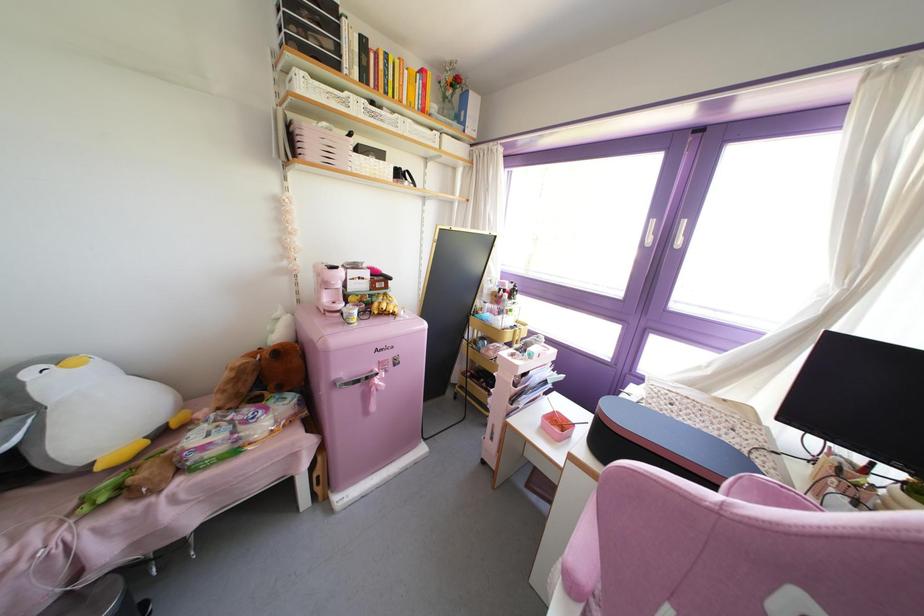
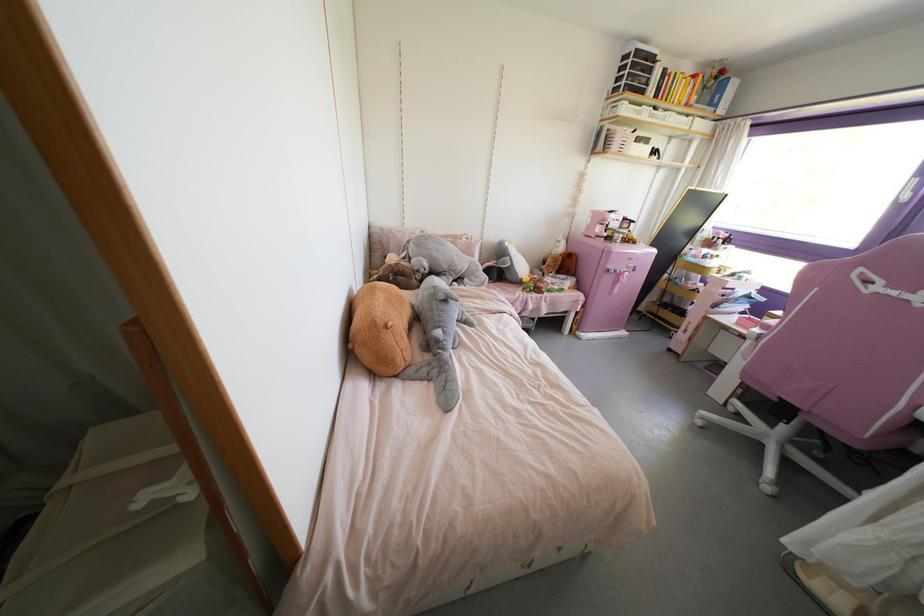
Locate, in the second image, the point that corresponds to pixel 99 467 in the first image.

(523, 280)